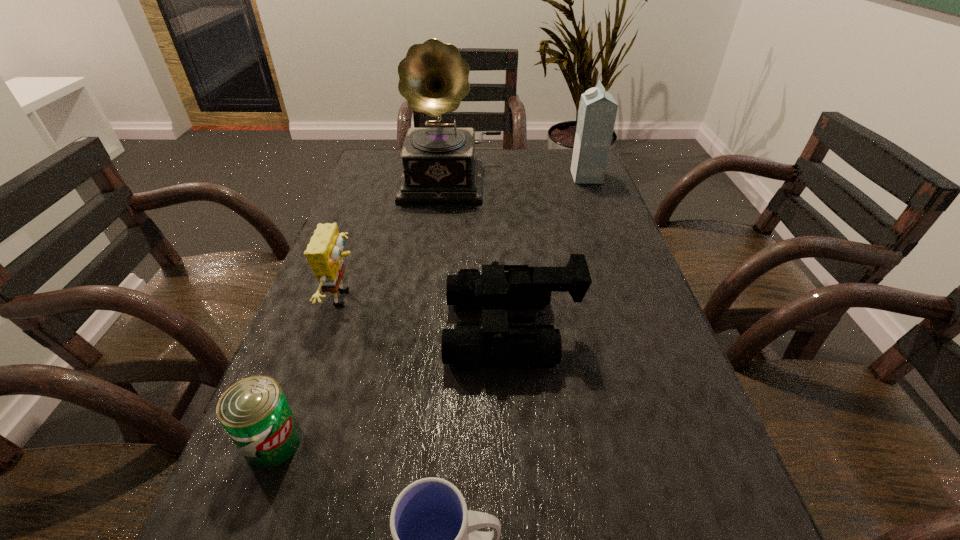
Image resolution: width=960 pixels, height=540 pixels. What are the coordinates of `vacant region located 0.190m on the front lenses of the binoculars` in the screenshot? It's located at tap(350, 330).

This screenshot has width=960, height=540. In order to click on free space located 0.050m on the front lenses of the binoculars in this screenshot , I will do `click(421, 330)`.

Identify the location of vacant space positioned 0.130m on the front lenses of the binoculars. (380, 330).

Image resolution: width=960 pixels, height=540 pixels. In order to click on vacant space situated on the face of the sponge in this screenshot , I will do `click(460, 298)`.

Identify the location of free space located on the right of the can. (351, 442).

In order to click on record player that is at the far edge in this screenshot , I will do `click(439, 165)`.

At what (x,y) coordinates should I click in order to perform the action: click on carton that is at the far edge. Please return your answer as a coordinate pair (x, y). Image resolution: width=960 pixels, height=540 pixels. Looking at the image, I should click on (597, 112).

The image size is (960, 540). I want to click on record player present at the left edge, so click(x=439, y=165).

Locate an element on the screen. sponge located in the left edge section of the desktop is located at coordinates (324, 253).

Locate an element on the screen. can present at the left edge is located at coordinates point(254,412).